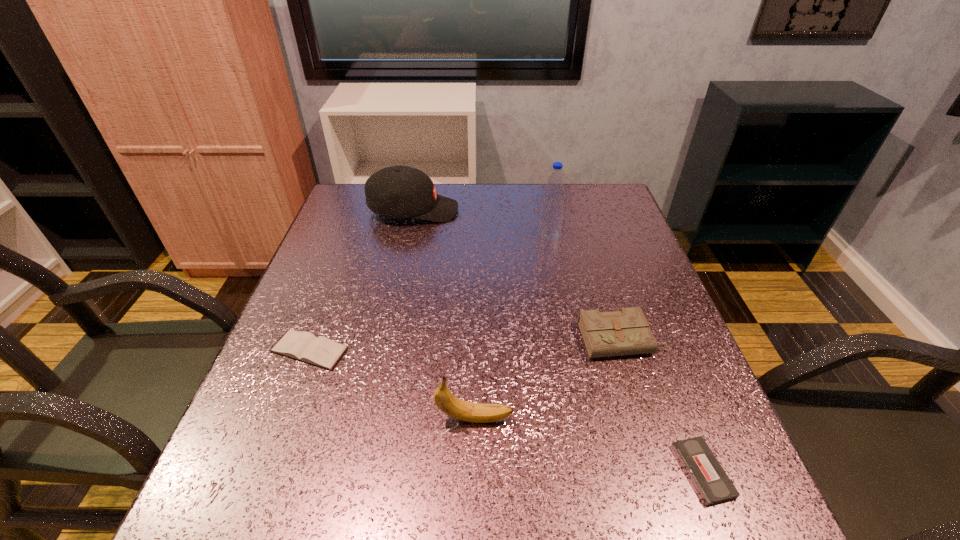
Identify the location of vacant area at the far right corner of the desktop. Image resolution: width=960 pixels, height=540 pixels. (604, 184).

I want to click on free space between the fifth nearest object and the taller diary, so click(x=586, y=287).

This screenshot has height=540, width=960. I want to click on unoccupied area between the banana and the second shortest object, so click(392, 384).

Find the location of a particular element. free space between the baseball cap and the third shortest object is located at coordinates (517, 275).

Find the location of a particular element. This screenshot has width=960, height=540. vacant area that lies between the videotape and the taller diary is located at coordinates (662, 405).

Locate an element on the screen. vacant point located between the second farthest object and the right diary is located at coordinates (586, 287).

What are the coordinates of `free point between the water bottle and the fourth tallest object` in the screenshot? It's located at (586, 287).

What are the coordinates of `vacant area between the fifth nearest object and the right diary` in the screenshot? It's located at (586, 287).

Find the location of a particular element. free space between the baseball cap and the right diary is located at coordinates (517, 275).

At what (x,y) coordinates should I click in order to perform the action: click on vacant area between the baseball cap and the shortest object. Please return your answer as a coordinate pair (x, y). This screenshot has width=960, height=540. Looking at the image, I should click on (558, 341).